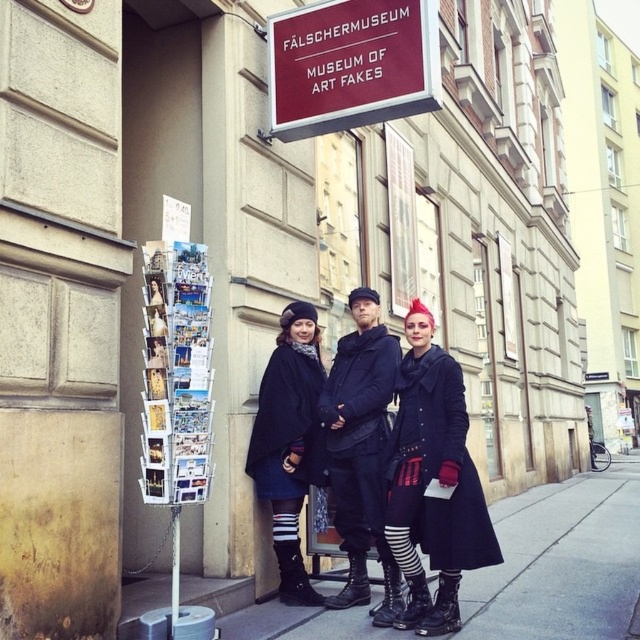
Question: Which object appears farthest from the camera in this image?

Choices:
 (A) black leather jacket at center
 (B) concrete sidewalk at lower center
 (C) black matte coat at center

Answer: (A)

Question: Does black matte coat at center appear over concrete sidewalk at lower center?

Choices:
 (A) yes
 (B) no

Answer: (A)

Question: Which object appears farthest from the camera in this image?

Choices:
 (A) black leather jacket at center
 (B) maroon matte sign at upper center
 (C) dark blue fabric dress at center

Answer: (B)

Question: Does maroon matte sign at upper center have a smaller size compared to black leather jacket at center?

Choices:
 (A) yes
 (B) no

Answer: (A)

Question: Which object appears farthest from the camera in this image?

Choices:
 (A) concrete sidewalk at lower center
 (B) dark blue fabric dress at center

Answer: (A)

Question: Is black matte coat at center above black leather jacket at center?

Choices:
 (A) yes
 (B) no

Answer: (A)